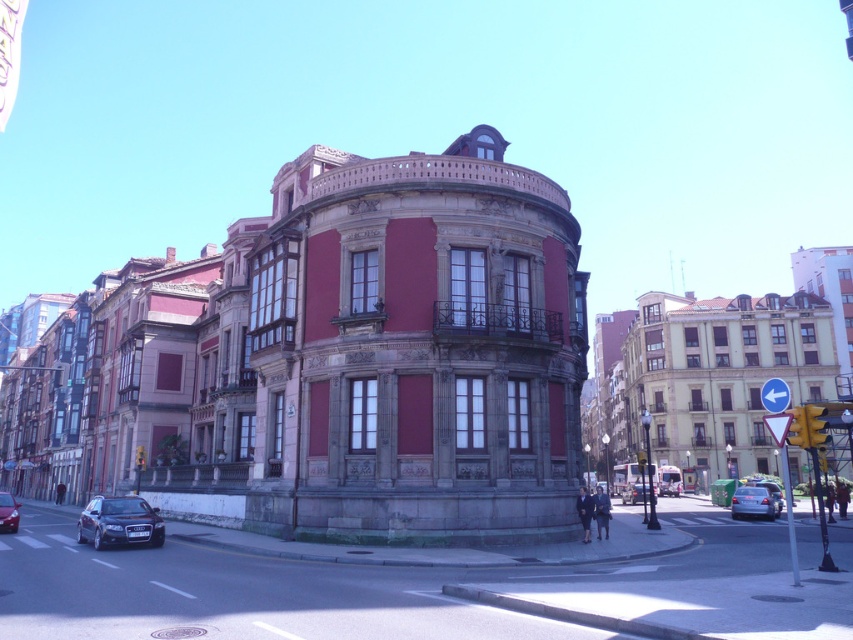
Question: Among these points, which one is nearest to the camera?

Choices:
 (A) pyautogui.click(x=642, y=500)
 (B) pyautogui.click(x=144, y=536)

Answer: (B)

Question: Does satin silver sedan at lower right appear over shiny black sedan at lower left?

Choices:
 (A) no
 (B) yes

Answer: (A)

Question: Which of the following is the closest to the observer?

Choices:
 (A) metallic silver sedan at lower right
 (B) satin black car at lower left
 (C) satin silver sedan at lower right
 (D) shiny black sedan at lower left

Answer: (B)

Question: Where is satin black car at lower left located in relation to satin silver sedan at lower right in the image?

Choices:
 (A) above
 (B) below

Answer: (A)

Question: Does shiny black sedan at lower left come behind metallic silver car at center?

Choices:
 (A) yes
 (B) no

Answer: (B)

Question: Which of the following is the closest to the observer?

Choices:
 (A) (0, 529)
 (B) (85, 541)

Answer: (B)